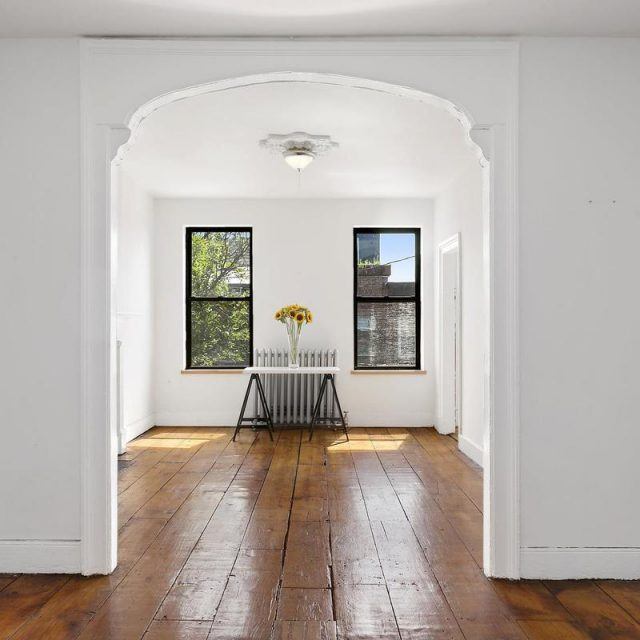
Where is `hard wood floor`? Image resolution: width=640 pixels, height=640 pixels. hard wood floor is located at coordinates (294, 505).